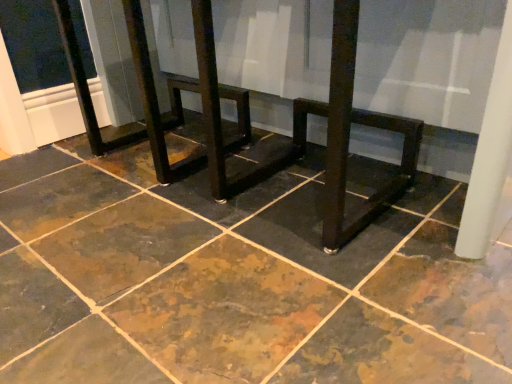
You are a GUI agent. You are given a task and a screenshot of the screen. Output one action in this format:
    pyautogui.click(x=<x>, y=<y>)
    Task: Click on the free space above marbled stone floor at center (from a real-world perspective)
    The image size is (512, 384).
    Given the screenshot: What is the action you would take?
    pyautogui.click(x=236, y=212)